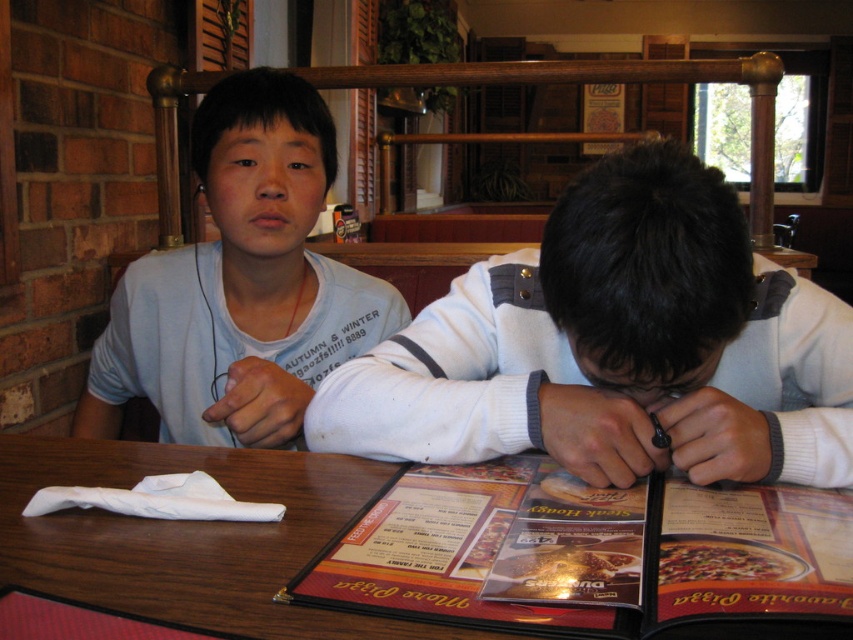
Question: Which of these objects is positioned closest to the matte plastic menu at center?

Choices:
 (A) white knit sweater at center
 (B) white cotton shirt at upper left

Answer: (A)

Question: Which object is closer to the camera taking this photo?

Choices:
 (A) white knit sweater at center
 (B) matte plastic menu at center

Answer: (B)

Question: Is white knit sweater at center wider than matte plastic menu at center?

Choices:
 (A) no
 (B) yes

Answer: (B)

Question: Can you confirm if white knit sweater at center is positioned above white cotton shirt at upper left?

Choices:
 (A) yes
 (B) no

Answer: (B)

Question: Can you confirm if matte plastic menu at center is bigger than white cotton shirt at upper left?

Choices:
 (A) no
 (B) yes

Answer: (A)

Question: Which object appears farthest from the camera in this image?

Choices:
 (A) white cotton shirt at upper left
 (B) white knit sweater at center
 (C) matte plastic menu at center

Answer: (A)